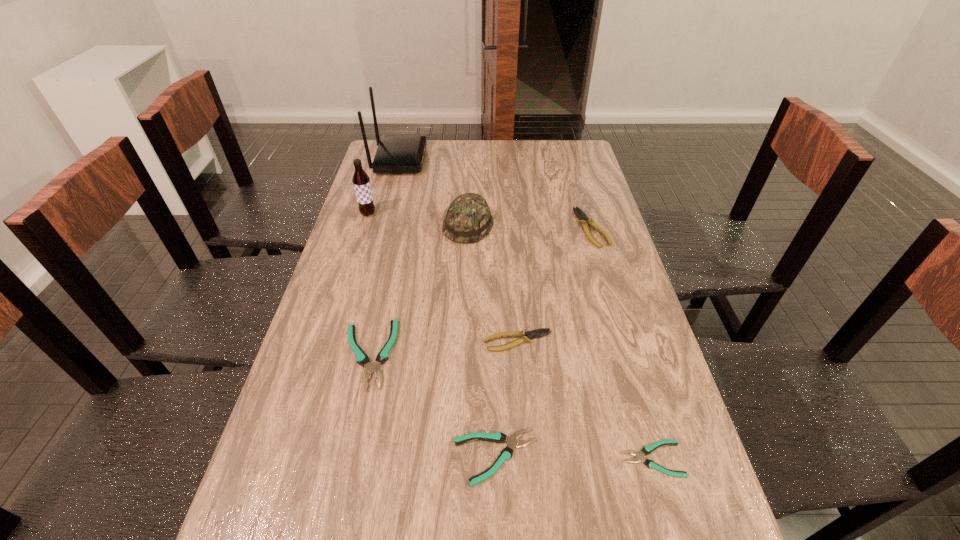
Where is `vacant space located on the back of the smaller yellow pliers`? The width and height of the screenshot is (960, 540). vacant space located on the back of the smaller yellow pliers is located at coordinates (514, 278).

Where is `blank space located on the left of the second smallest teal pliers`? This screenshot has width=960, height=540. blank space located on the left of the second smallest teal pliers is located at coordinates (313, 457).

Find the location of a particular element. Image resolution: width=960 pixels, height=540 pixels. vacant region located 0.290m on the back of the smallest teal pliers is located at coordinates (616, 331).

You are a GUI agent. You are given a task and a screenshot of the screen. Output one action in this format:
    pyautogui.click(x=<x>, y=<y>)
    Task: Click on the object that is positioned at the far edge
    The height and width of the screenshot is (540, 960).
    Given the screenshot: What is the action you would take?
    pyautogui.click(x=396, y=153)

I want to click on router situated at the left edge, so click(396, 153).

Image resolution: width=960 pixels, height=540 pixels. Identify the location of root beer present at the left edge. (361, 181).

Locate an element on the screen. Image resolution: width=960 pixels, height=540 pixels. pliers that is at the left edge is located at coordinates (362, 359).

Where is `object present at the far left corner`? object present at the far left corner is located at coordinates (396, 153).

Where is `free region at the far edge`? This screenshot has height=540, width=960. free region at the far edge is located at coordinates (447, 141).

Image resolution: width=960 pixels, height=540 pixels. In order to click on vacant space at the left edge of the desktop in this screenshot , I will do `click(287, 462)`.